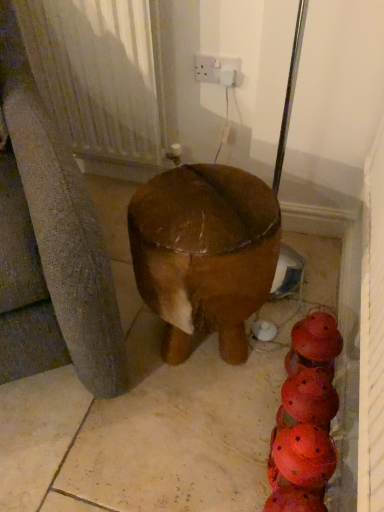
Question: Is brown matte concrete at center located within brown polished wood stool at center?

Choices:
 (A) no
 (B) yes

Answer: (A)

Question: Is brown polished wood stool at center outside of brown matte concrete at center?

Choices:
 (A) no
 (B) yes

Answer: (B)

Question: Is brown polished wood stool at center looking in the opposite direction of brown matte concrete at center?

Choices:
 (A) yes
 (B) no

Answer: (B)

Question: Is the position of brown polished wood stool at center less distant than that of brown matte concrete at center?

Choices:
 (A) yes
 (B) no

Answer: (A)

Question: Can you confirm if brown polished wood stool at center is smaller than brown matte concrete at center?

Choices:
 (A) yes
 (B) no

Answer: (A)

Question: Is brown polished wood stool at center bigger than brown matte concrete at center?

Choices:
 (A) no
 (B) yes

Answer: (A)

Question: Is white textured radiator at upper left far from brown polished wood stool at center?

Choices:
 (A) no
 (B) yes

Answer: (A)

Question: From the image's perspective, is white textured radiator at upper left above brown polished wood stool at center?

Choices:
 (A) no
 (B) yes

Answer: (B)

Question: Is brown polished wood stool at center a part of white textured radiator at upper left?

Choices:
 (A) no
 (B) yes

Answer: (A)

Question: Is white textured radiator at upper left at the left side of brown polished wood stool at center?

Choices:
 (A) yes
 (B) no

Answer: (A)

Question: Is white textured radiator at upper left in contact with brown polished wood stool at center?

Choices:
 (A) yes
 (B) no

Answer: (B)

Question: From the image's perspective, does white textured radiator at upper left appear lower than brown polished wood stool at center?

Choices:
 (A) no
 (B) yes

Answer: (A)

Question: Is white textured radiator at upper left to the right of white plastic socket at upper center from the viewer's perspective?

Choices:
 (A) yes
 (B) no

Answer: (B)